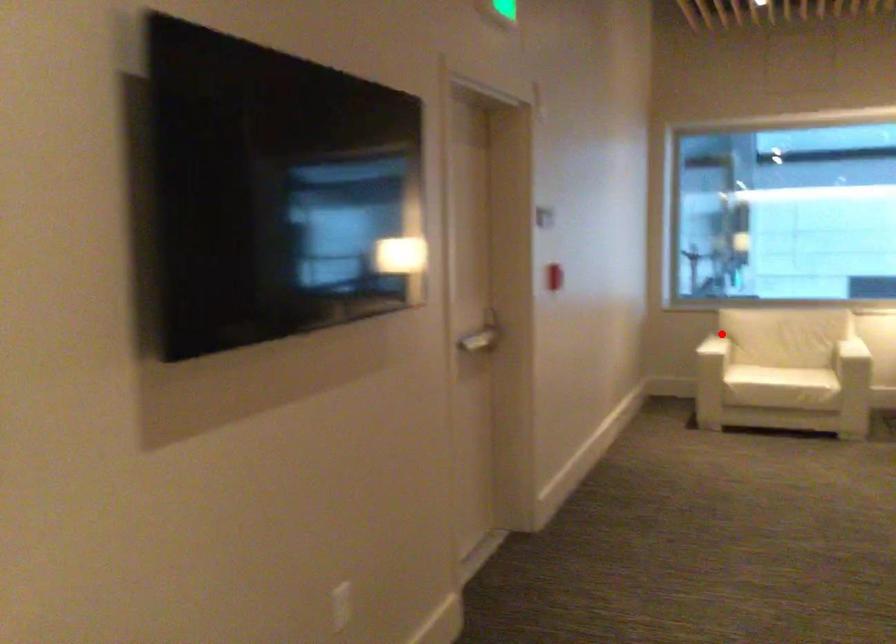
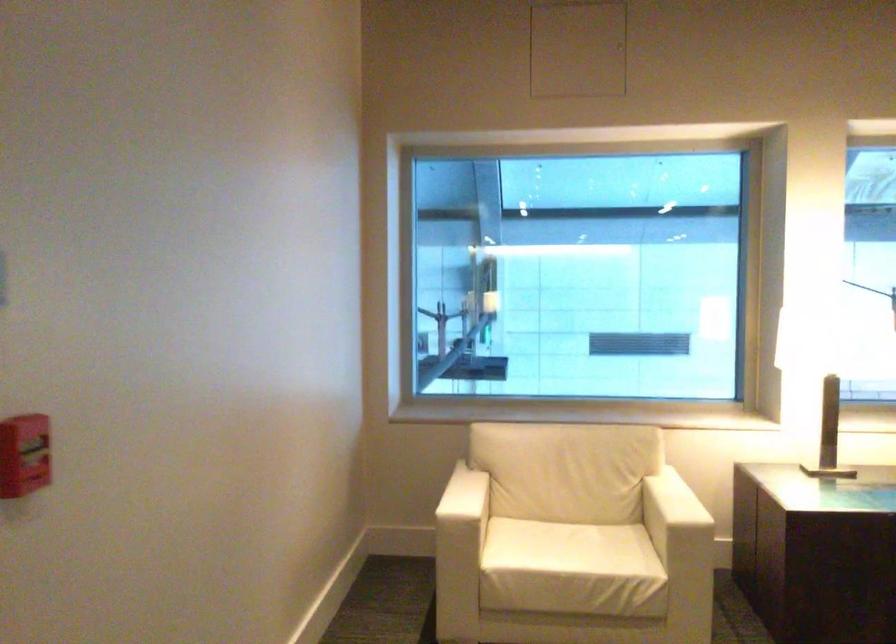
The point at the highlighted location is marked in the first image. Where is the corresponding point in the second image?

(462, 498)